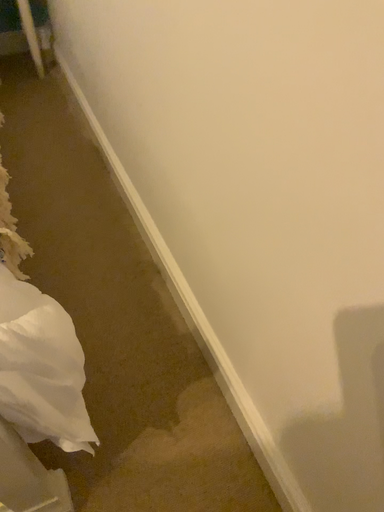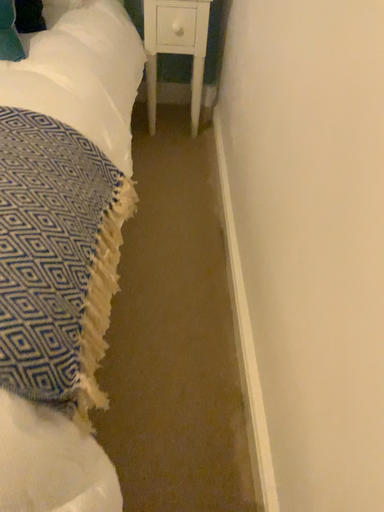
Question: Which way did the camera rotate in the video?

Choices:
 (A) rotated right
 (B) rotated left

Answer: (B)